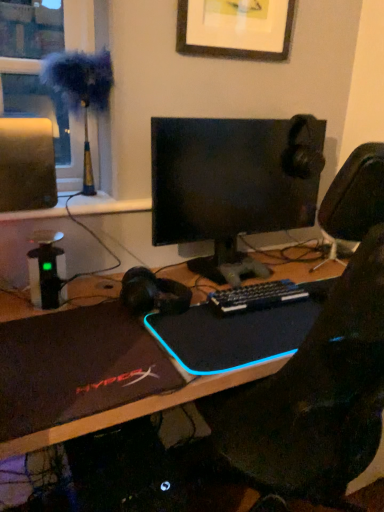
This screenshot has height=512, width=384. In order to click on vacant area on top of black matte desk at center (from a real-world perspective) in this screenshot , I will do `click(196, 305)`.